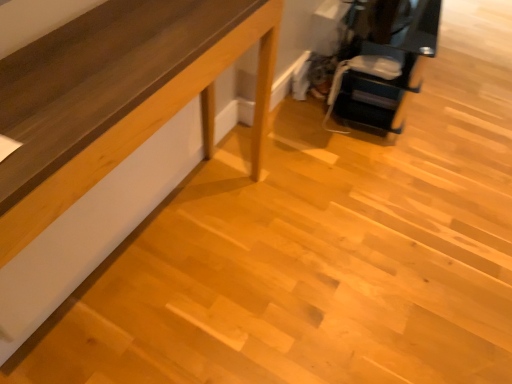
The image size is (512, 384). I want to click on vacant area in front of light brown wood table at lower left, acting as the 1th furniture starting from the bottom, so click(x=139, y=298).